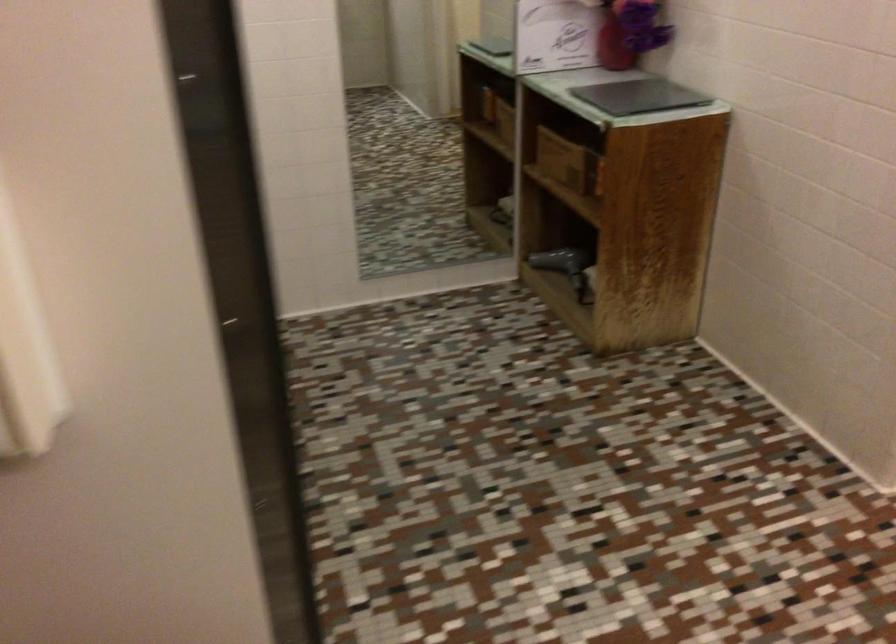
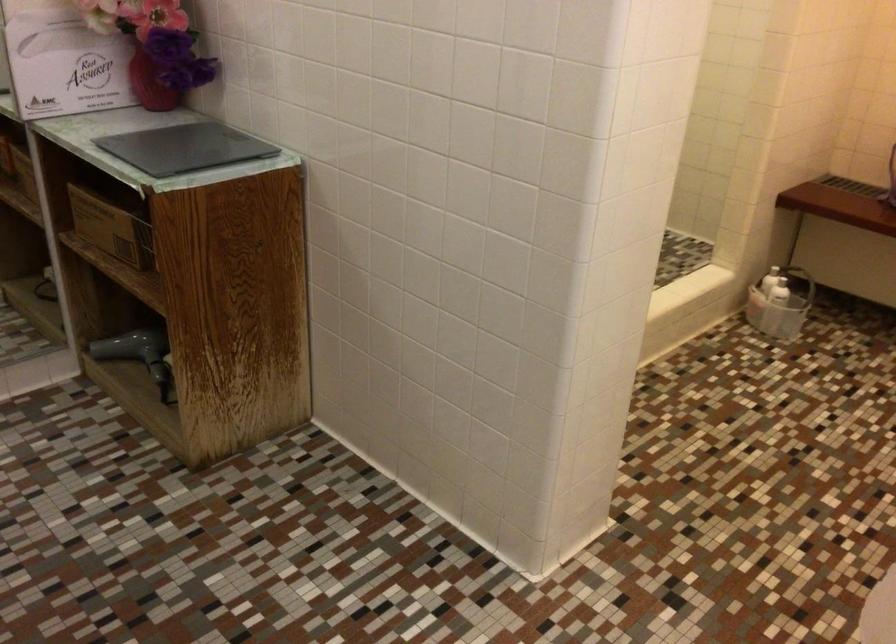
Question: The images are taken continuously from a first-person perspective. In which direction is your viewpoint rotating?

Choices:
 (A) Left
 (B) Right
 (C) Up
 (D) Down

Answer: (B)